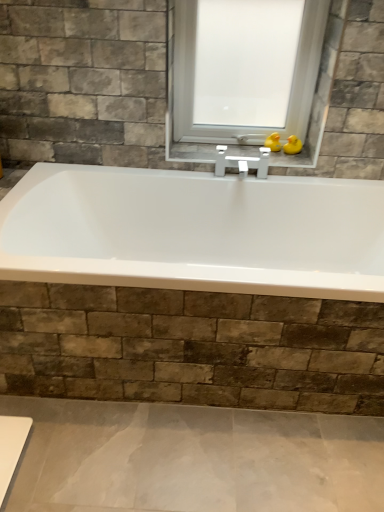
Question: Is yellow rubber duck at upper right, the 2th duck in the left-to-right sequence, positioned with its back to yellow rubber duck at upper center, the 1th duck viewed from the left?

Choices:
 (A) no
 (B) yes

Answer: (A)

Question: Does yellow rubber duck at upper right, the 2th duck in the left-to-right sequence, contain yellow rubber duck at upper center, the 1th duck viewed from the left?

Choices:
 (A) yes
 (B) no

Answer: (B)

Question: Is yellow rubber duck at upper right, the 1th duck when ordered from right to left, next to yellow rubber duck at upper center, marked as the 2th duck in a right-to-left arrangement?

Choices:
 (A) no
 (B) yes

Answer: (B)

Question: Is yellow rubber duck at upper right, the 1th duck when ordered from right to left, wider than yellow rubber duck at upper center, the 1th duck viewed from the left?

Choices:
 (A) no
 (B) yes

Answer: (A)

Question: Is yellow rubber duck at upper right, the 1th duck when ordered from right to left, aimed at yellow rubber duck at upper center, the 1th duck viewed from the left?

Choices:
 (A) yes
 (B) no

Answer: (B)

Question: From the image's perspective, is yellow rubber duck at upper right, the 1th duck when ordered from right to left, located above or below yellow rubber duck at upper center, marked as the 2th duck in a right-to-left arrangement?

Choices:
 (A) above
 (B) below

Answer: (B)

Question: Is point (292, 153) positioned closer to the camera than point (271, 137)?

Choices:
 (A) closer
 (B) farther

Answer: (A)

Question: Is yellow rubber duck at upper right, the 1th duck when ordered from right to left, inside or outside of yellow rubber duck at upper center, marked as the 2th duck in a right-to-left arrangement?

Choices:
 (A) outside
 (B) inside

Answer: (A)

Question: Looking at the image, does yellow rubber duck at upper right, the 1th duck when ordered from right to left, seem bigger or smaller compared to yellow rubber duck at upper center, marked as the 2th duck in a right-to-left arrangement?

Choices:
 (A) big
 (B) small

Answer: (A)

Question: Considering the positions of point (278, 142) and point (283, 148), is point (278, 142) closer or farther from the camera than point (283, 148)?

Choices:
 (A) farther
 (B) closer

Answer: (A)

Question: Is yellow rubber duck at upper center, marked as the 2th duck in a right-to-left arrangement, taller or shorter than yellow rubber duck at upper right, the 2th duck in the left-to-right sequence?

Choices:
 (A) short
 (B) tall

Answer: (B)

Question: From the image's perspective, relative to yellow rubber duck at upper right, the 1th duck when ordered from right to left, is yellow rubber duck at upper center, marked as the 2th duck in a right-to-left arrangement, above or below?

Choices:
 (A) above
 (B) below

Answer: (A)

Question: Is yellow rubber duck at upper center, the 1th duck viewed from the left, wider or thinner than yellow rubber duck at upper right, the 1th duck when ordered from right to left?

Choices:
 (A) wide
 (B) thin

Answer: (A)

Question: From a real-world perspective, is transparent glass window at center physically located above or below yellow rubber duck at upper right, the 2th duck in the left-to-right sequence?

Choices:
 (A) below
 (B) above

Answer: (B)

Question: From the image's perspective, relative to yellow rubber duck at upper right, the 2th duck in the left-to-right sequence, is transparent glass window at center above or below?

Choices:
 (A) above
 (B) below

Answer: (A)